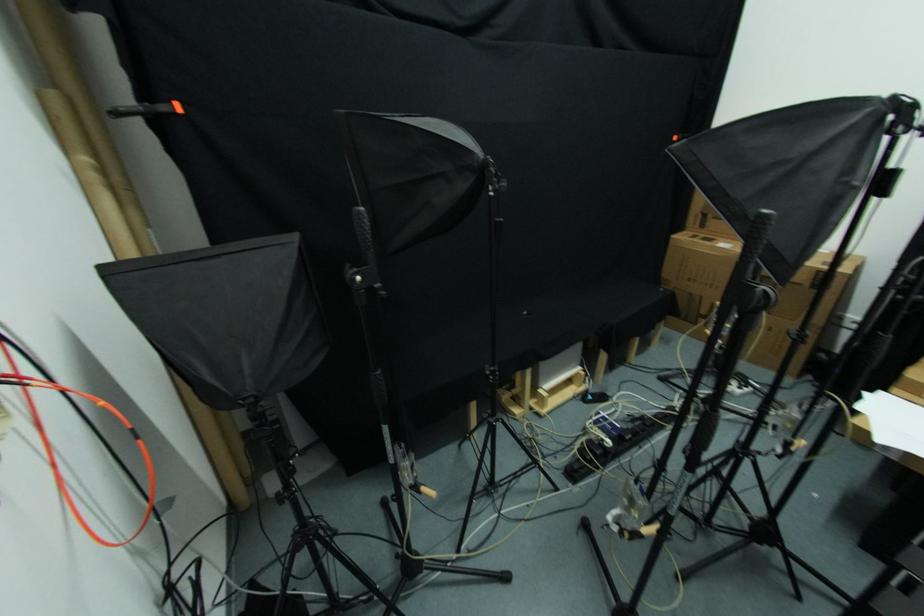
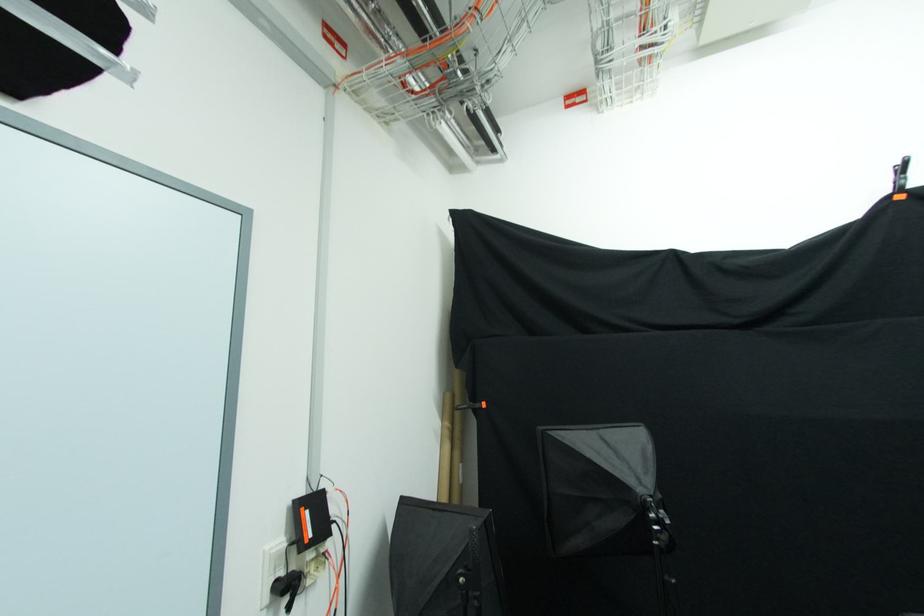
In the second image, find the point that corresponds to [152,233] in the first image.

(462, 468)